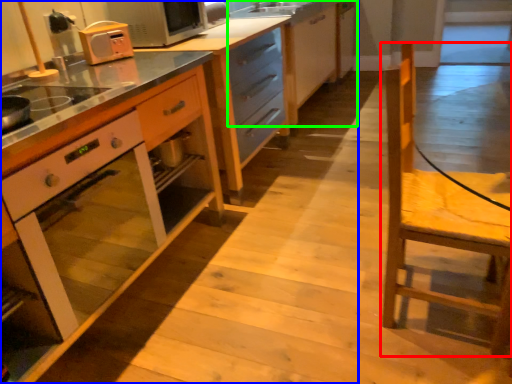
Question: Which object is the farthest from chair (highlighted by a red box)? Choose among these: cabinetry (highlighted by a blue box) or cabinetry (highlighted by a green box).

Choices:
 (A) cabinetry
 (B) cabinetry

Answer: (B)